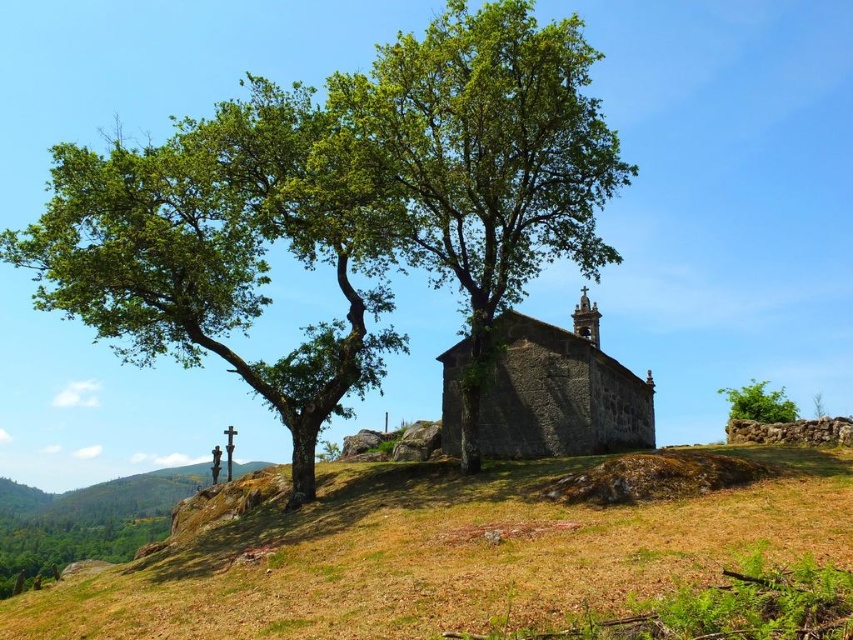
In the scene shown: Is green leafy tree at left smaller than stone church at center?

Incorrect, green leafy tree at left is not smaller in size than stone church at center.

Is green leafy tree at left wider than stone church at center?

Indeed, green leafy tree at left has a greater width compared to stone church at center.

The width and height of the screenshot is (853, 640). I want to click on green leafy tree at left, so click(x=213, y=252).

Is dry grass at center positioned in front of green leafy bush at upper right?

Yes.

Can you confirm if dry grass at center is taller than green leafy bush at upper right?

Yes, dry grass at center is taller than green leafy bush at upper right.

You are a GUI agent. You are given a task and a screenshot of the screen. Output one action in this format:
    pyautogui.click(x=<x>, y=<y>)
    Task: Click on the dry grass at center
    The width and height of the screenshot is (853, 640).
    Given the screenshot: What is the action you would take?
    pyautogui.click(x=450, y=556)

The image size is (853, 640). I want to click on green leafy tree at center, so click(474, 163).

Between green leafy tree at center and stone church at center, which one appears on the right side from the viewer's perspective?

Positioned to the right is stone church at center.

Who is more distant from viewer, (466, 438) or (646, 428)?

Point (646, 428)

Locate an element on the screen. green leafy tree at center is located at coordinates (474, 163).